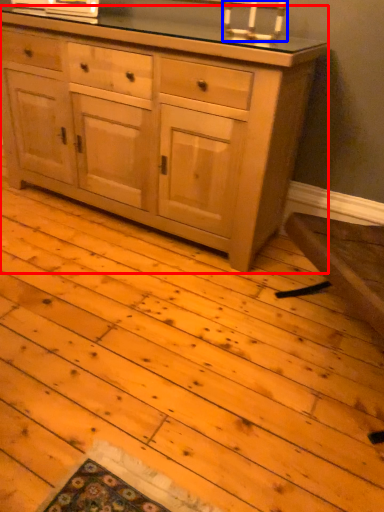
Question: Which point is closer to the camera, chest of drawers (highlighted by a red box) or candle holder (highlighted by a blue box)?

Choices:
 (A) chest of drawers
 (B) candle holder

Answer: (A)